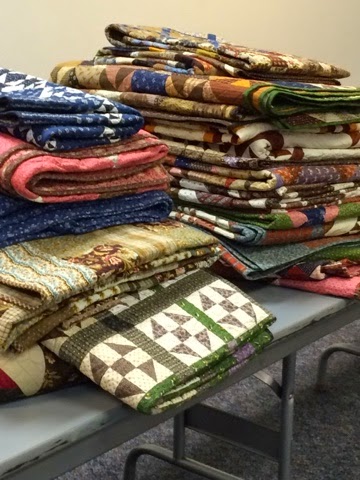
This screenshot has width=360, height=480. What are the coordinates of `carpet` in the screenshot? It's located at (315, 440).